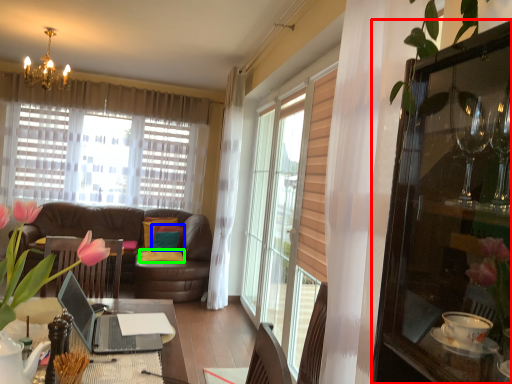
Question: Based on their relative distances, which object is nearer to cabinetry (highlighted by a red box)? Choose from pillow (highlighted by a blue box) and pillow (highlighted by a green box).

Choices:
 (A) pillow
 (B) pillow

Answer: (B)